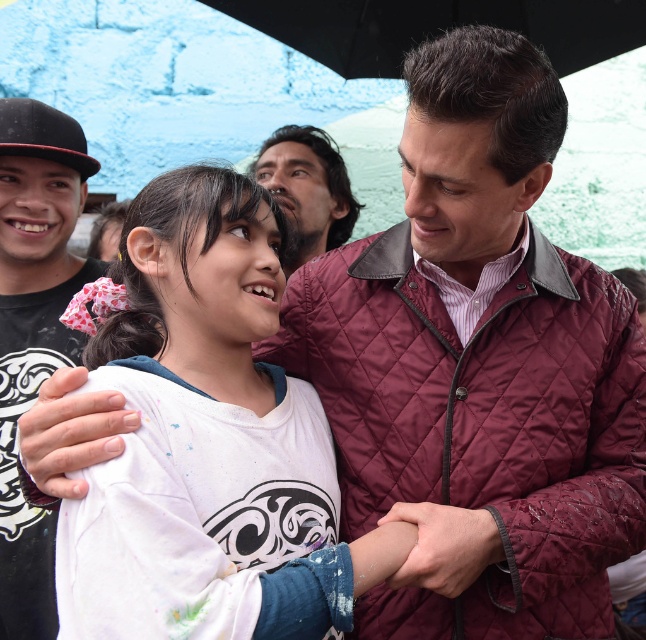
Question: Which of these objects is positioned farthest from the black matte umbrella at upper center?

Choices:
 (A) white cotton shirt at center
 (B) black quilted jacket at left
 (C) dark brown hair at upper center

Answer: (A)

Question: Does white cotton shirt at center appear on the right side of black matte umbrella at upper center?

Choices:
 (A) yes
 (B) no

Answer: (B)

Question: Which point appears farthest from the camera in this image?

Choices:
 (A) (152, 432)
 (B) (16, 524)
 (C) (300, 164)

Answer: (C)

Question: Among these objects, which one is nearest to the camera?

Choices:
 (A) dark brown hair at upper center
 (B) white cotton shirt at center
 (C) black quilted jacket at left
 (D) black matte umbrella at upper center

Answer: (B)

Question: Is the position of black quilted jacket at left less distant than that of black matte umbrella at upper center?

Choices:
 (A) no
 (B) yes

Answer: (B)

Question: Considering the relative positions of white cotton shirt at center and dark brown hair at upper center in the image provided, where is white cotton shirt at center located with respect to dark brown hair at upper center?

Choices:
 (A) left
 (B) right

Answer: (A)